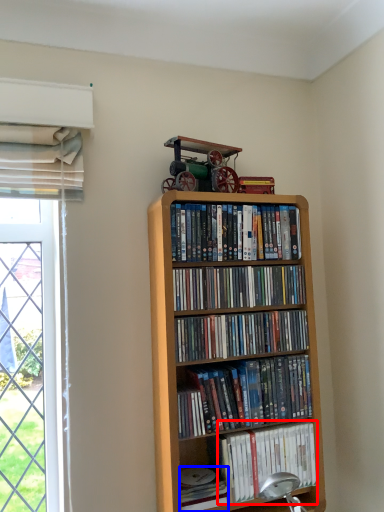
Question: Which of the following is the farthest to the observer, book (highlighted by a red box) or paperback book (highlighted by a blue box)?

Choices:
 (A) book
 (B) paperback book

Answer: (A)